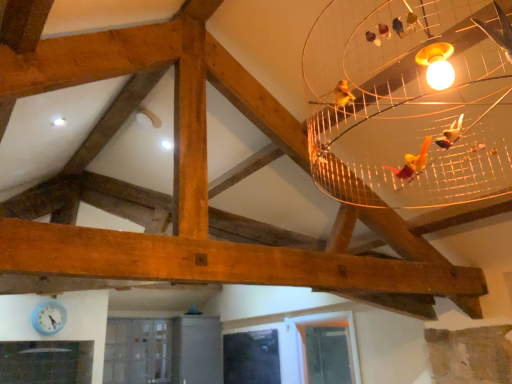
Question: Considering the positions of transparent glass window at lower center, which is the 1th window from left to right, and light blue plastic clock at lower left in the image, is transparent glass window at lower center, which is the 1th window from left to right, bigger or smaller than light blue plastic clock at lower left?

Choices:
 (A) small
 (B) big

Answer: (B)

Question: From their relative heights in the image, would you say transparent glass window at lower center, which appears as the 2th window when viewed from the right, is taller or shorter than light blue plastic clock at lower left?

Choices:
 (A) short
 (B) tall

Answer: (B)

Question: Estimate the real-world distances between objects in this image. Which object is farther from the light blue plastic clock at lower left?

Choices:
 (A) clear glass window at lower center, arranged as the second window when viewed from the back
 (B) transparent glass window at lower center, which is the 1th window from left to right

Answer: (A)

Question: Considering the real-world distances, which object is farthest from the light blue plastic clock at lower left?

Choices:
 (A) transparent glass window at lower center, which is the 1th window from left to right
 (B) clear glass window at lower center, which is counted as the 2th window, starting from the left

Answer: (B)